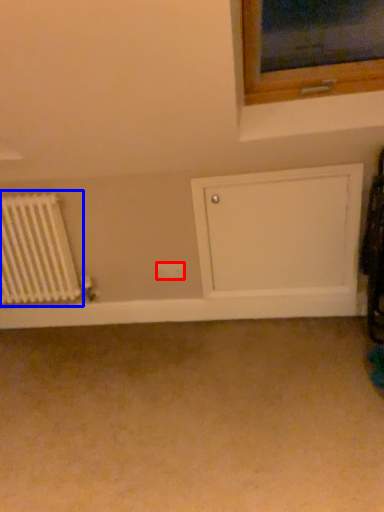
Question: Which object appears closest to the camera in this image, electric outlet (highlighted by a red box) or radiator (highlighted by a blue box)?

Choices:
 (A) electric outlet
 (B) radiator

Answer: (B)